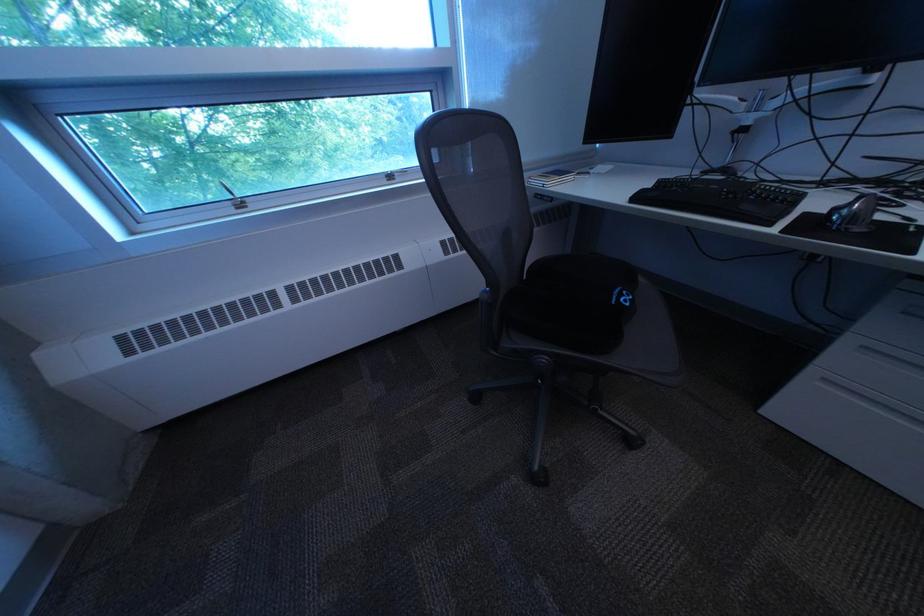
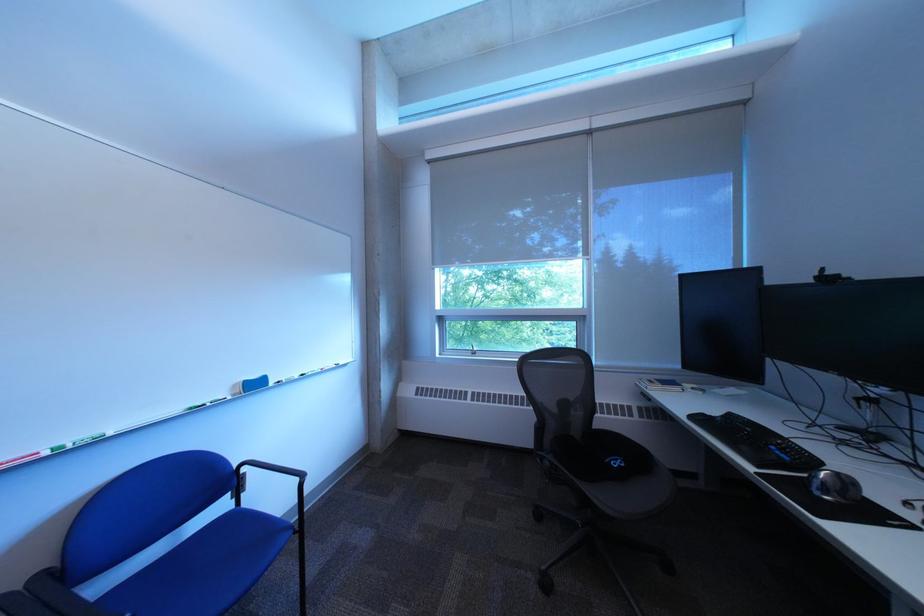
Question: I am providing you with two images of the same scene from different viewpoints. Please identify which objects are invisible in image2.

Choices:
 (A) blue whiteboard eraser
 (B) black chair armrest
 (C) window crank handle
 (D) none of these

Answer: (D)